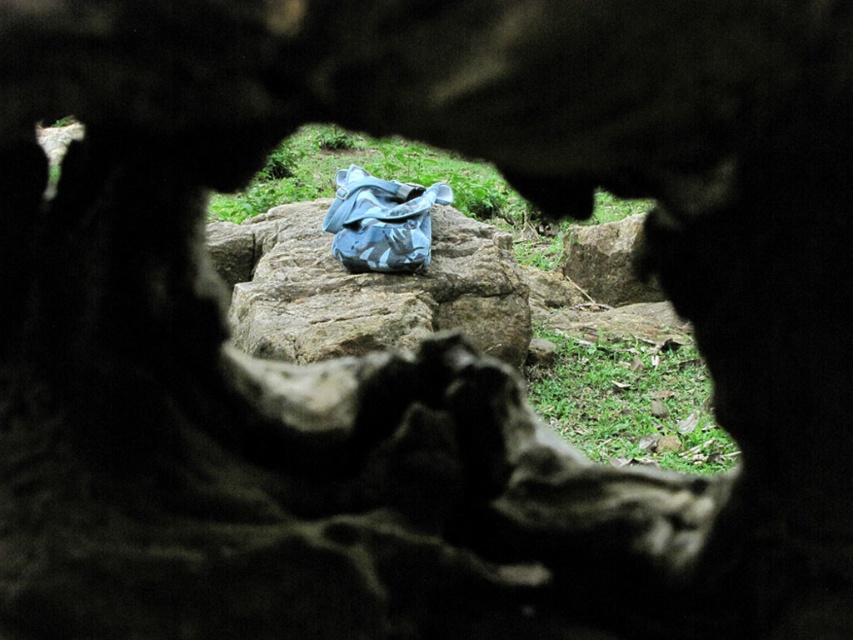
Question: Is rough textured rock at center wider than blue camouflage bag at center?

Choices:
 (A) no
 (B) yes

Answer: (B)

Question: Which point is farther to the camera?

Choices:
 (A) (352, 272)
 (B) (509, 301)

Answer: (B)

Question: Considering the relative positions of rough textured rock at center and blue camouflage bag at center in the image provided, where is rough textured rock at center located with respect to blue camouflage bag at center?

Choices:
 (A) below
 (B) above

Answer: (A)

Question: Which of the following is the farthest from the observer?

Choices:
 (A) blue camouflage bag at center
 (B) rough textured rock at center

Answer: (A)

Question: Is rough textured rock at center smaller than blue camouflage bag at center?

Choices:
 (A) yes
 (B) no

Answer: (B)